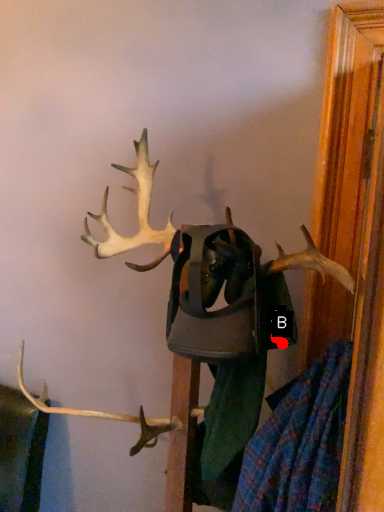
Question: Two points are circled on the image, labeled by A and B beside each circle. Which point appears closest to the camera in this image?

Choices:
 (A) A is closer
 (B) B is closer

Answer: (A)